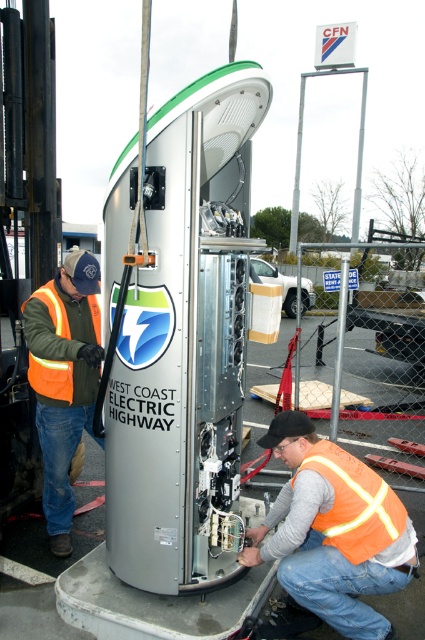
Based on the photo, you are standing in front of the West Coast Electric Highway charging station. There is a point marked at coordinates (333, 531). Which object does this point belong to?

The point at coordinates (333, 531) is located on the orange reflective vest at lower center.